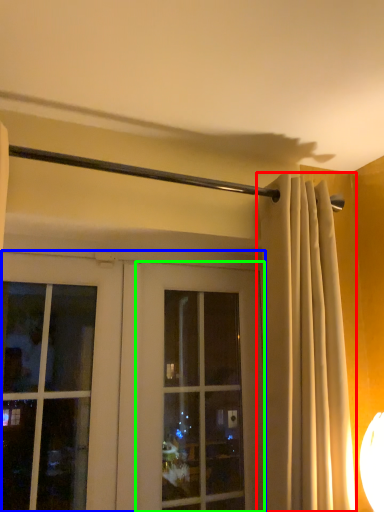
Question: Which is farther away from curtain (highlighted by a red box)? door (highlighted by a blue box) or window (highlighted by a green box)?

Choices:
 (A) door
 (B) window

Answer: (A)